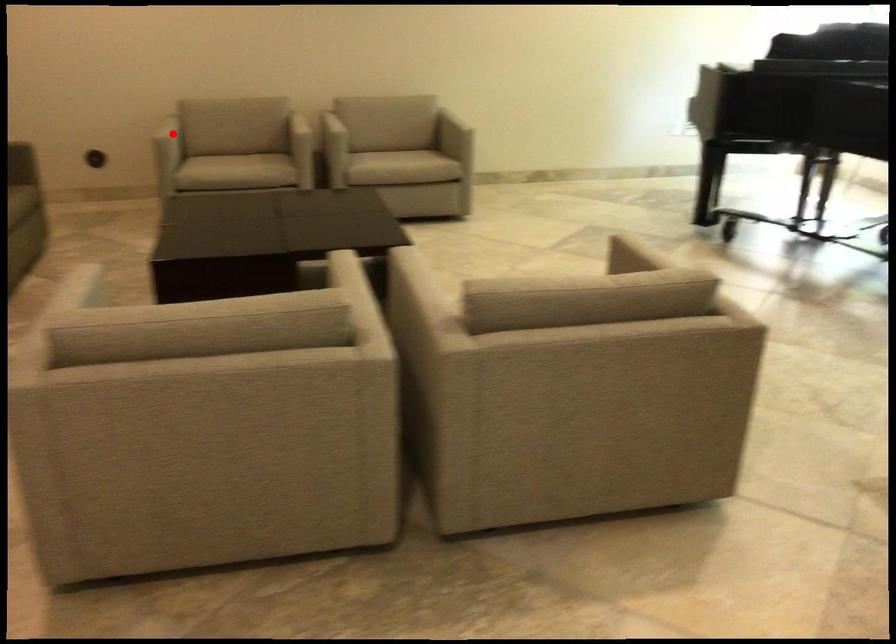
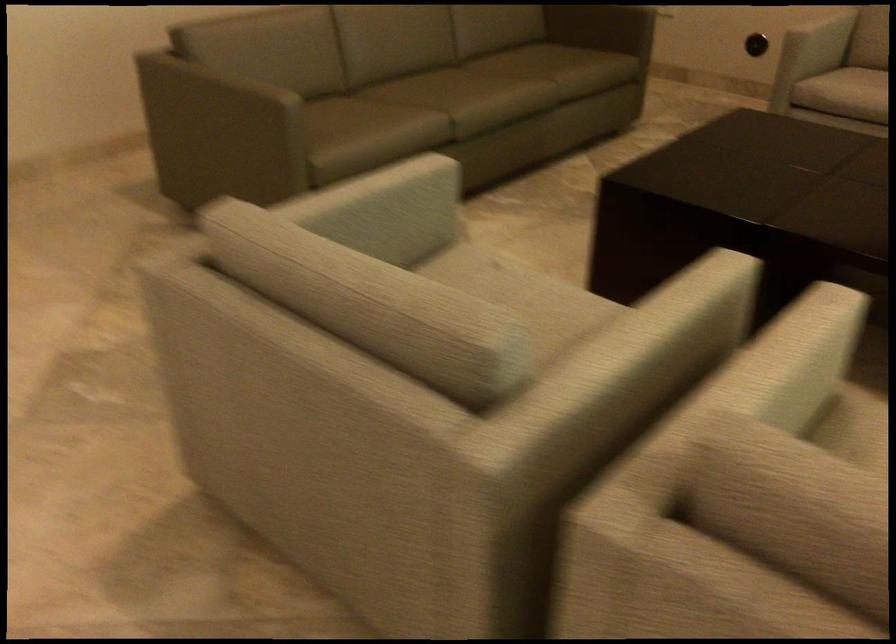
Question: I am providing you with two images of the same scene from different viewpoints. In image1, a red point is highlighted. Considering the same 3D point in image2, which of the following is correct?

Choices:
 (A) It is closer
 (B) It is farther

Answer: (A)